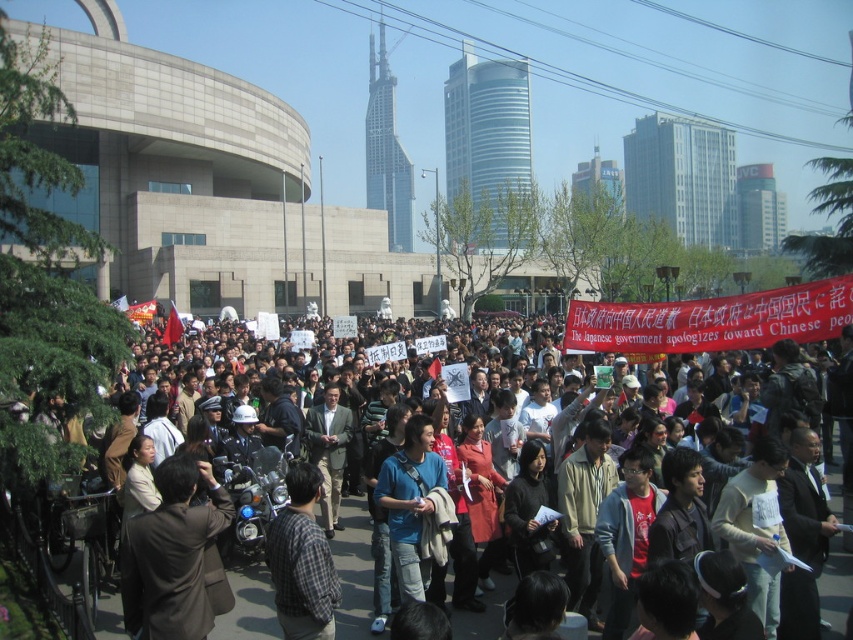
From the picture: Does brown fabric coat at lower left come in front of shiny chrome motorcycle at lower left?

Yes, it is in front of shiny chrome motorcycle at lower left.

Does brown fabric coat at lower left come behind shiny chrome motorcycle at lower left?

No, it is in front of shiny chrome motorcycle at lower left.

The height and width of the screenshot is (640, 853). Identify the location of brown fabric coat at lower left. (172, 554).

From the picture: Measure the distance between point (161, 580) and camera.

They are 94.25 feet apart.

Between point (167, 502) and point (292, 636), which one is positioned in front?

Point (167, 502) is in front.

Describe the element at coordinates (172, 554) in the screenshot. This screenshot has height=640, width=853. I see `brown fabric coat at lower left` at that location.

Where is `brown fabric coat at lower left`? brown fabric coat at lower left is located at coordinates (172, 554).

Is multicolored fabric crowd at center to the left of brown fabric coat at lower left from the viewer's perspective?

No, multicolored fabric crowd at center is not to the left of brown fabric coat at lower left.

Can you confirm if multicolored fabric crowd at center is taller than brown fabric coat at lower left?

Correct, multicolored fabric crowd at center is much taller as brown fabric coat at lower left.

Is point (500, 588) closer to camera compared to point (199, 566)?

No, (500, 588) is further to viewer.

The width and height of the screenshot is (853, 640). In order to click on multicolored fabric crowd at center in this screenshot , I will do `click(27, 600)`.